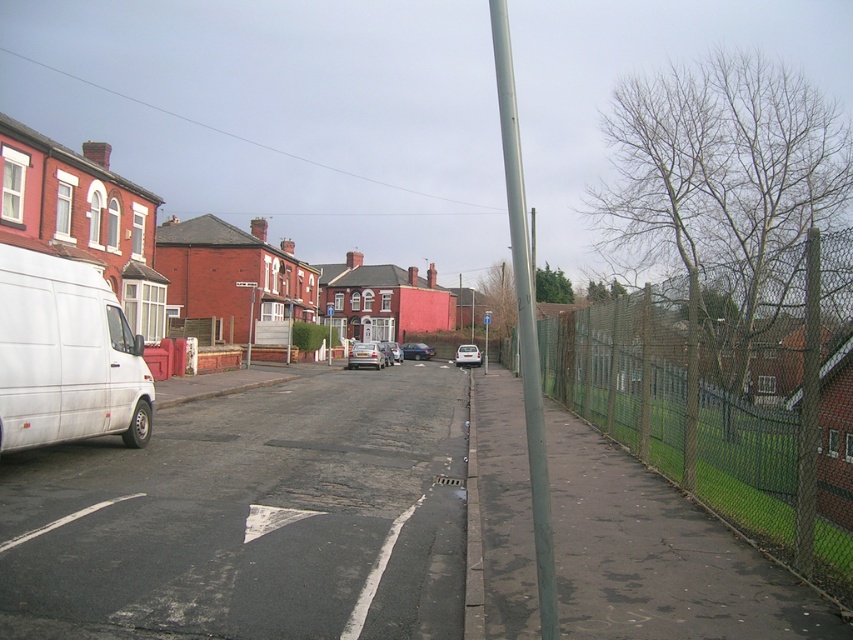
You are a pedestrian standing at the edge of the street. You see a silver metallic car at center and a metallic rectangular sign at center. How far apart are these two objects from each other?

The silver metallic car at center and the metallic rectangular sign at center are 9.89 meters apart from each other.